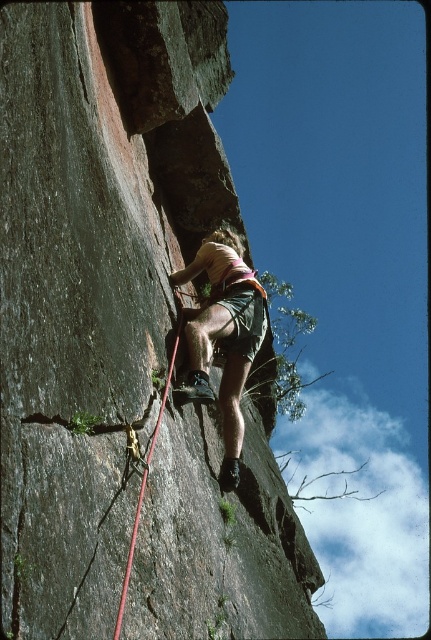
Is matte pink shorts at center taller than red nylon rope at center?

Yes.

Is matte pink shorts at center shorter than red nylon rope at center?

In fact, matte pink shorts at center may be taller than red nylon rope at center.

You are a GUI agent. You are given a task and a screenshot of the screen. Output one action in this format:
    pyautogui.click(x=<x>, y=<y>)
    Task: Click on the matte pink shorts at center
    The width and height of the screenshot is (431, 640).
    Given the screenshot: What is the action you would take?
    pyautogui.click(x=224, y=337)

At what (x,y) coordinates should I click in order to perform the action: click on matte pink shorts at center. Please return your answer as a coordinate pair (x, y). Image resolution: width=431 pixels, height=640 pixels. Looking at the image, I should click on (224, 337).